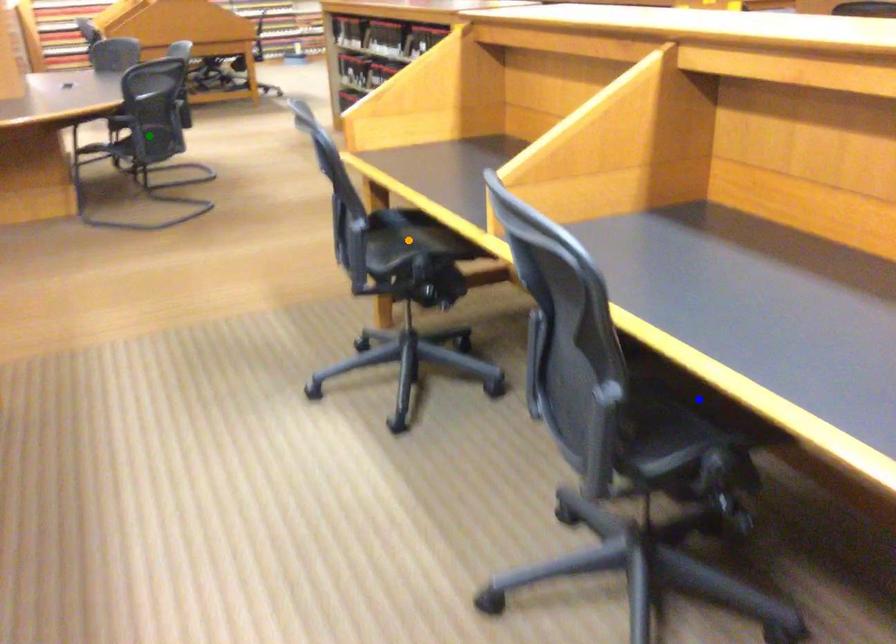
Order these from nearest to farthest:
blue point | orange point | green point

blue point < orange point < green point